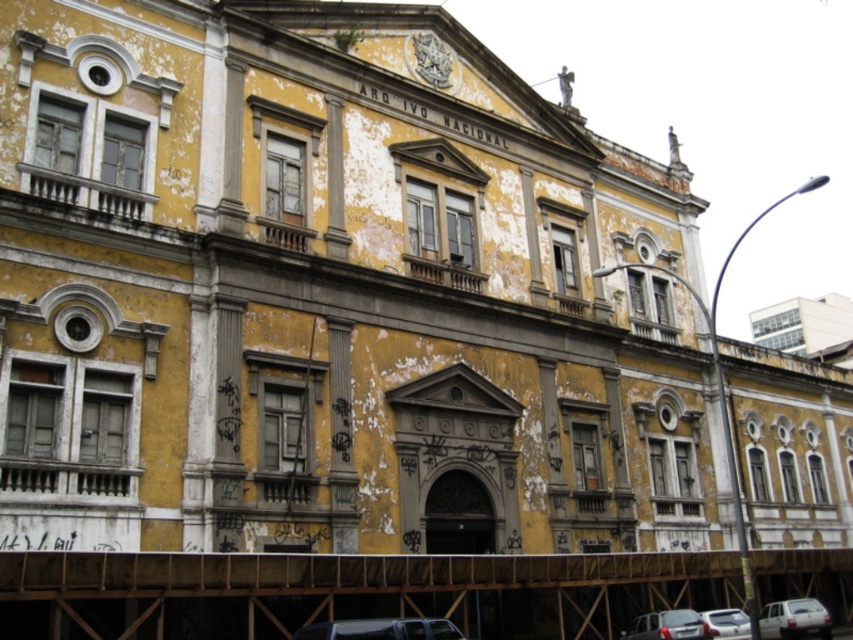
Which of these two, metallic silver car at lower center or white glossy car at lower right, stands shorter?

white glossy car at lower right is shorter.

Who is positioned more to the right, metallic silver car at lower center or white glossy car at lower right?

Positioned to the right is white glossy car at lower right.

What are the coordinates of `metallic silver car at lower center` in the screenshot? It's located at (381, 628).

Consider the image. Can you confirm if metallic silver car at lower center is positioned to the right of white matte car at lower right?

In fact, metallic silver car at lower center is to the left of white matte car at lower right.

Which is more to the left, metallic silver car at lower center or white matte car at lower right?

Positioned to the left is metallic silver car at lower center.

Is point (427, 628) farther from camera compared to point (831, 625)?

No, (427, 628) is in front of (831, 625).

Locate an element on the screen. The height and width of the screenshot is (640, 853). metallic silver car at lower center is located at coordinates (381, 628).

Between point (763, 609) and point (737, 616), which one is positioned in front?

Point (737, 616) is in front.

Does point (814, 618) lie in front of point (724, 625)?

That is False.

Between point (764, 625) and point (744, 632), which one is positioned behind?

Positioned behind is point (764, 625).

This screenshot has height=640, width=853. Find the location of `white matte car at lower right`. white matte car at lower right is located at coordinates (793, 620).